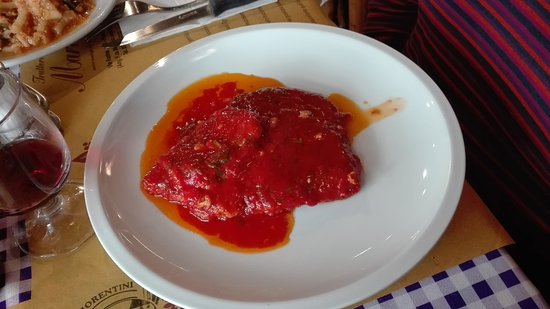
You are a GUI agent. You are given a task and a screenshot of the screen. Output one action in this format:
    pyautogui.click(x=<x>, y=<y>)
    Task: Click on the white plate
    The width and height of the screenshot is (550, 309).
    Given the screenshot: What is the action you would take?
    pyautogui.click(x=351, y=230)